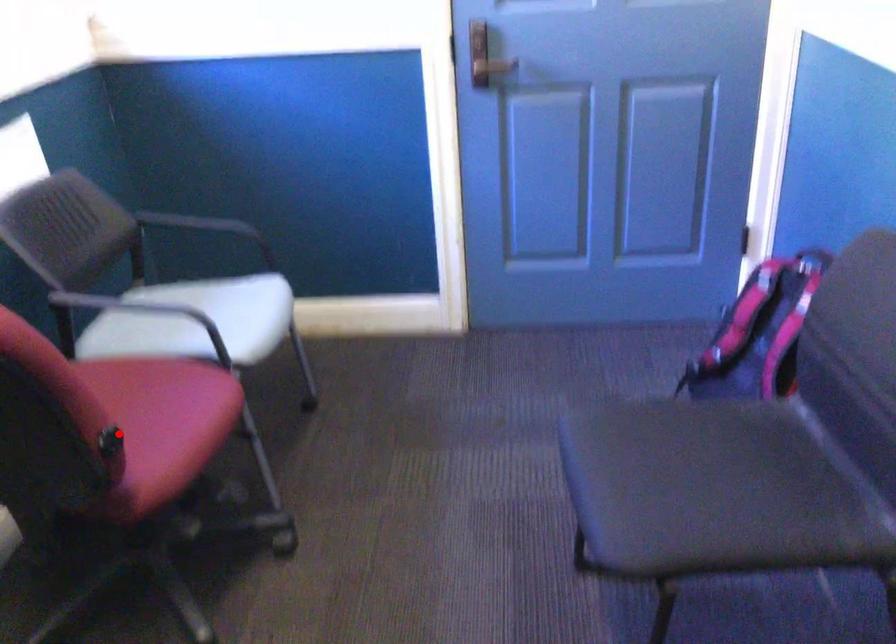
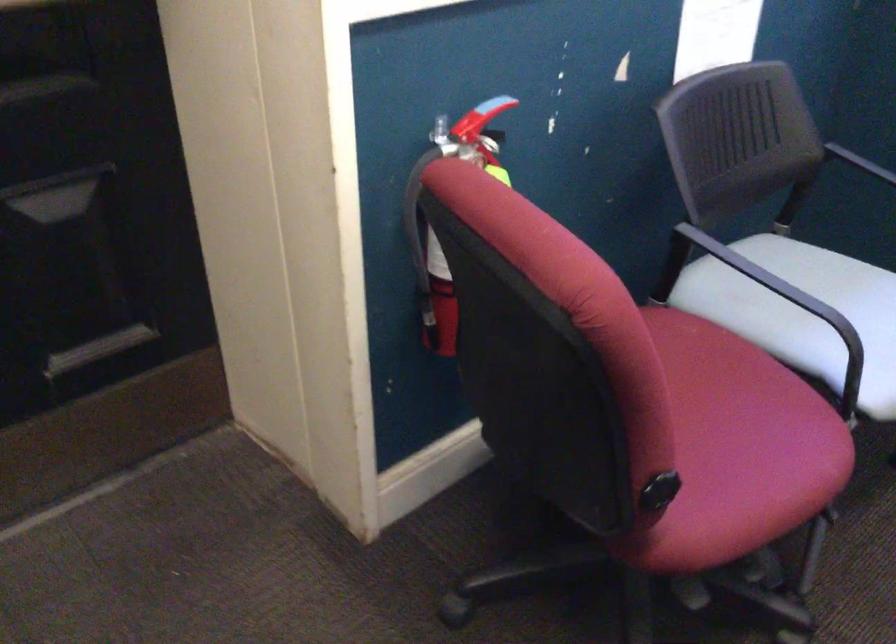
Question: I am providing you with two images of the same scene from different viewpoints. A red point is shown in image1. For the corresponding object point in image2, is it positioned nearer or farther from the camera?

Choices:
 (A) Nearer
 (B) Farther

Answer: (A)